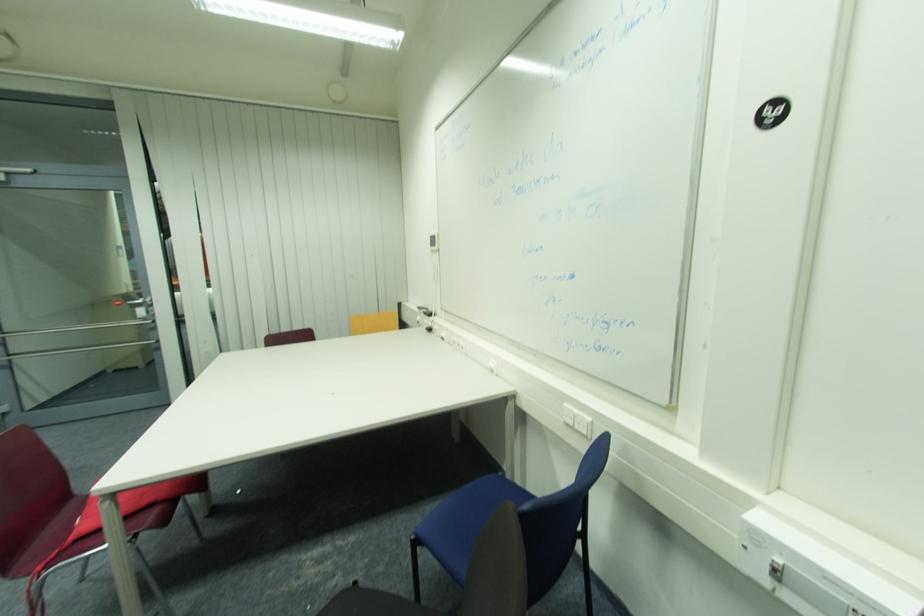
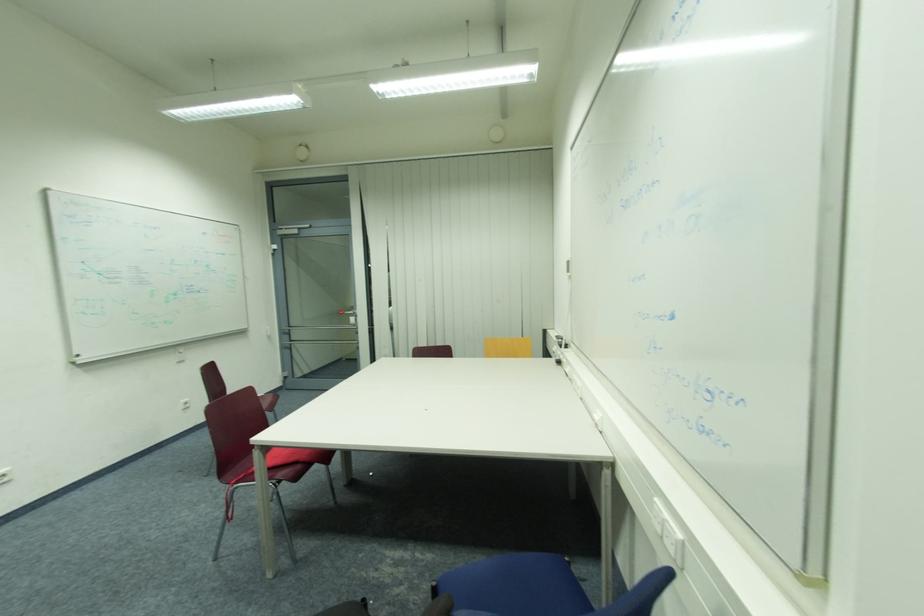
Locate, in the second image, the point that corresponds to (415,539) in the first image.

(439, 583)